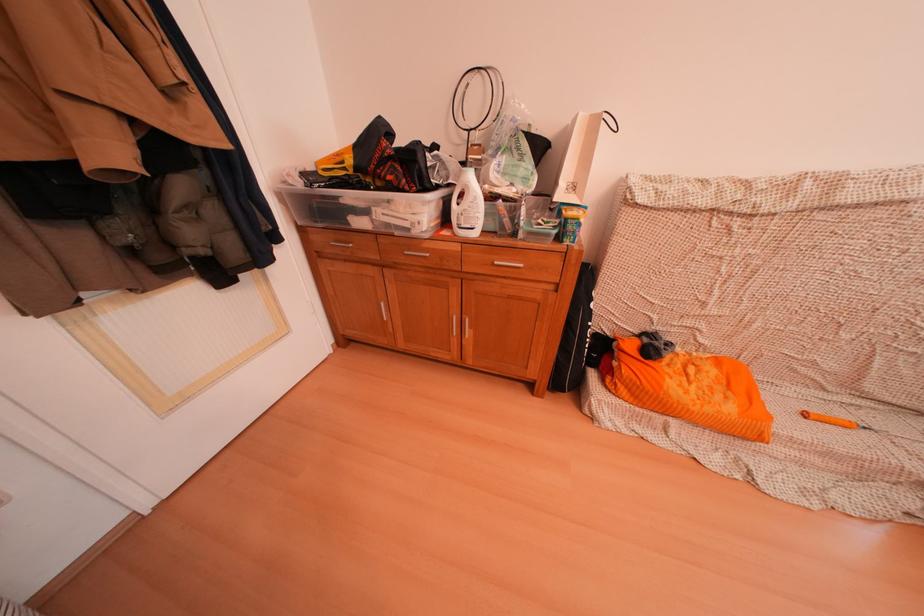
The width and height of the screenshot is (924, 616). Describe the element at coordinates (611, 121) in the screenshot. I see `the paper bag handle` at that location.